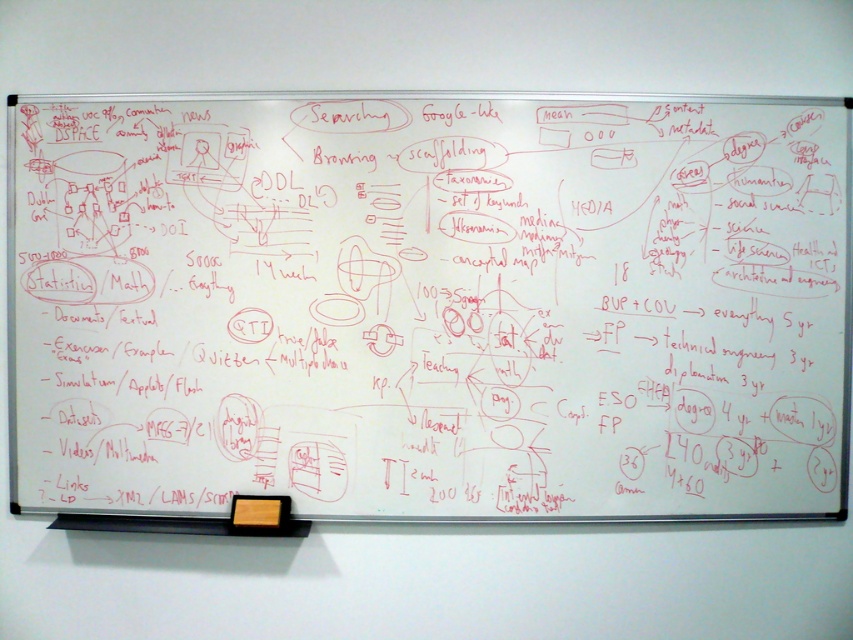
You are a student trying to take a photo of the whiteboard at upper center for your notes. There is an orange matte sticky note at lower center in the way. Can you move the sticky note to the side without covering the whiteboard?

The whiteboard at upper center is larger in size than the orange matte sticky note at lower center, so moving the sticky note to the side would allow the whiteboard to be fully visible in the photo.

You are a student who needs to take a note on the whiteboard at upper center and the orange matte sticky note at lower center. Which object is located higher up on the board?

The whiteboard at upper center is located higher up than the orange matte sticky note at lower center.

You are organizing a classroom and need to place a 12 inch ruler horizontally between the whiteboard at upper center and the orange matte sticky note at lower center. Considering their widths, will the ruler fit without overlapping either object?

The whiteboard at upper center is wider than the orange matte sticky note at lower center. Since the ruler is 12 inches long, it can be placed between them horizontally as long as the distance between their edges accommodates the ruler without overlapping. However, the width comparison alone doesn